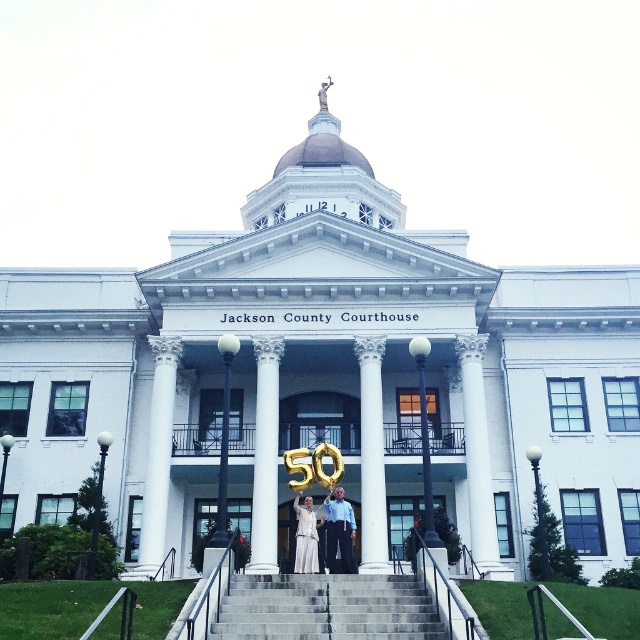
You are a visitor approaching the Jackson County Courthouse and notice the gray concrete stairs at center and the white smooth column at center. Which of these two objects is smaller in size?

The gray concrete stairs at center is smaller in size compared to the white smooth column at center.

You are a visitor arriving at the Jackson County Courthouse. You notice the gray concrete stairs at center and the white marble column at center. Which of these two objects is wider?

The gray concrete stairs at center is wider than the white marble column at center.